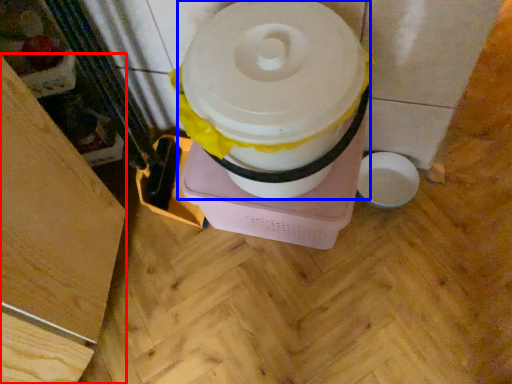
Question: Which point is further to the camera, wood (highlighted by a red box) or toilet paper (highlighted by a blue box)?

Choices:
 (A) wood
 (B) toilet paper

Answer: (B)